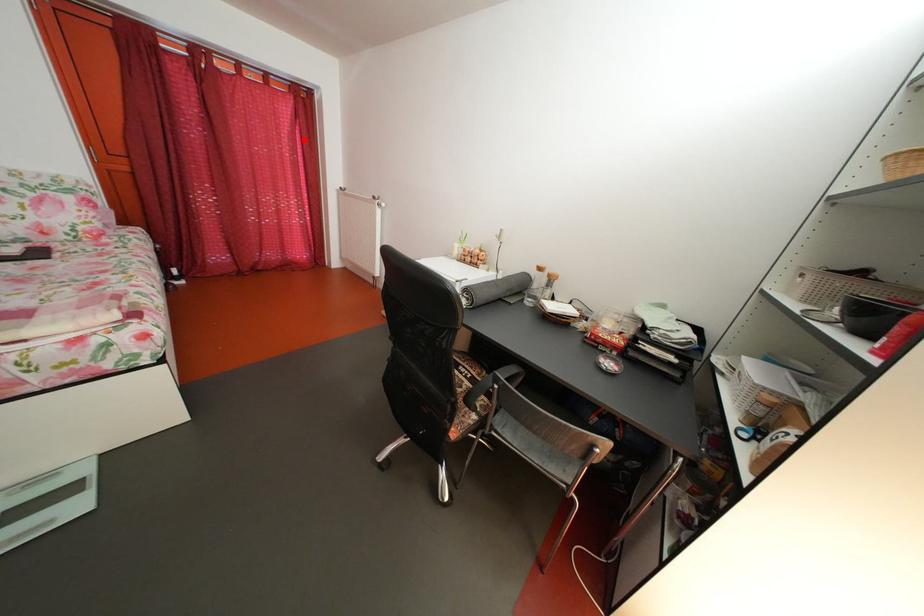
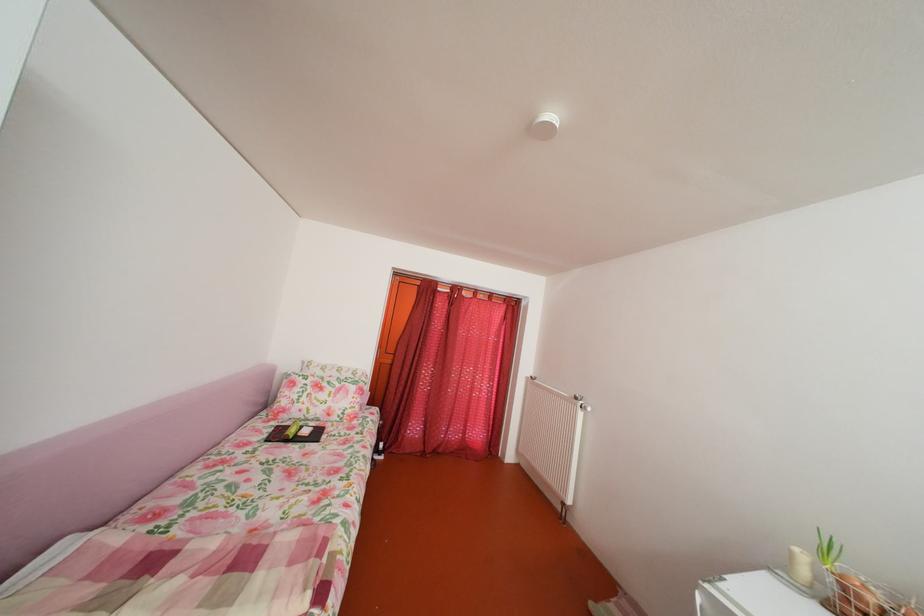
In the second image, find the point that corresponds to the highlighted location in the first image.

(511, 337)